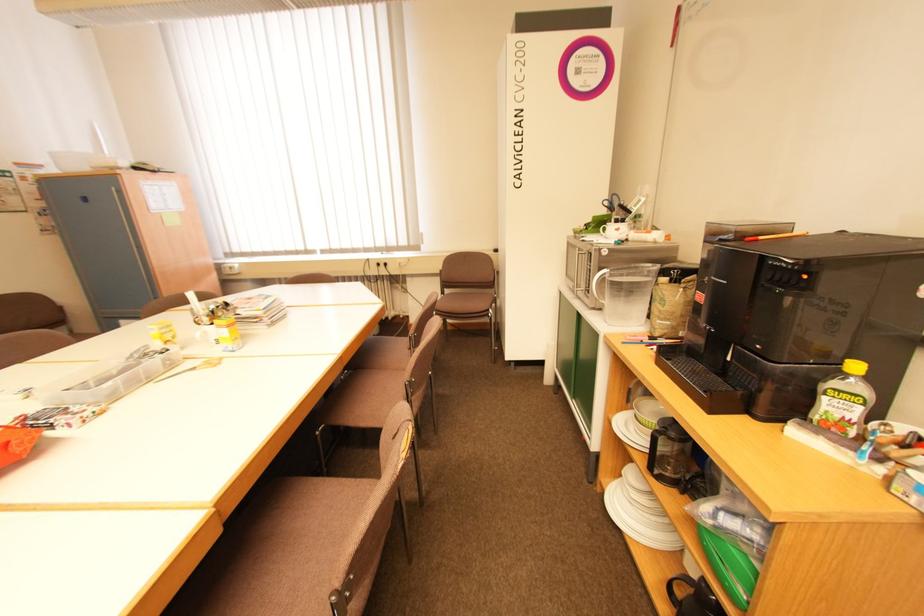
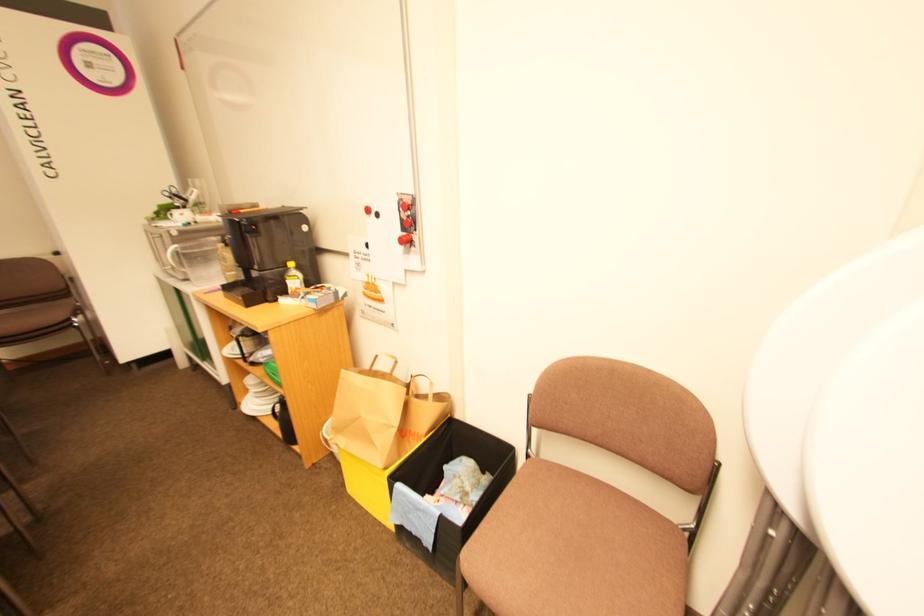
Question: The camera is either moving clockwise (left) or counter-clockwise (right) around the object. The first image is from the beginning of the video and the second image is from the end. Is the camera moving left or right when shooting the video?

Choices:
 (A) Left
 (B) Right

Answer: (A)